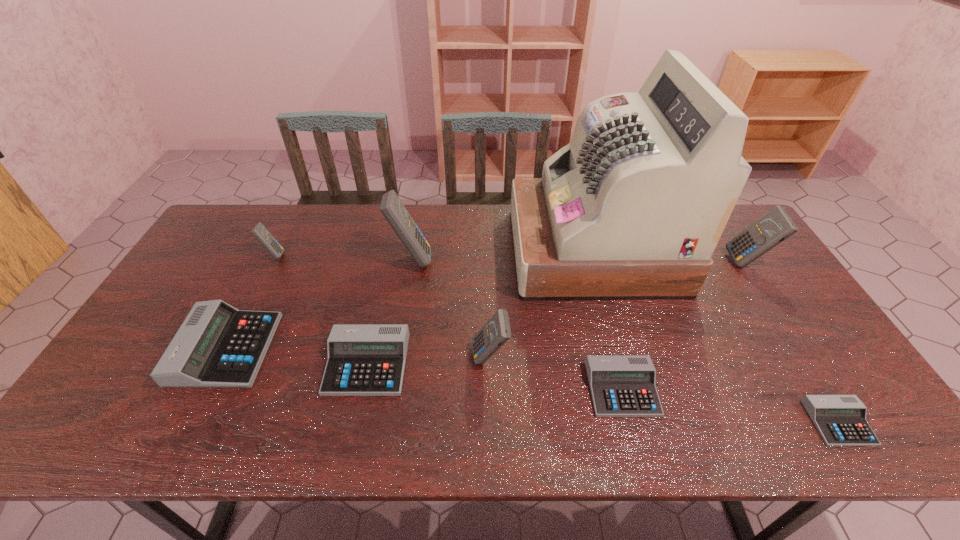
Find the location of a particular element. This screenshot has width=960, height=540. cash register is located at coordinates (633, 207).

Locate an element on the screen. The image size is (960, 540). the biggest blue calculator is located at coordinates (392, 208).

Locate an element on the screen. This screenshot has height=540, width=960. the tallest calculator is located at coordinates (392, 208).

The width and height of the screenshot is (960, 540). Find the location of `the seventh shortest calculator`. the seventh shortest calculator is located at coordinates (775, 226).

I want to click on the seventh shortest object, so click(775, 226).

Image resolution: width=960 pixels, height=540 pixels. What are the coordinates of `the sixth shortest object` in the screenshot? It's located at (496, 332).

The width and height of the screenshot is (960, 540). Find the location of `the nearest blue calculator`. the nearest blue calculator is located at coordinates (496, 332).

Find the location of a particular element. the fifth shortest object is located at coordinates (259, 231).

Locate an element on the screen. This screenshot has height=540, width=960. the smallest blue calculator is located at coordinates (259, 231).

What are the coordinates of `the sixth tallest object` in the screenshot? It's located at (217, 346).